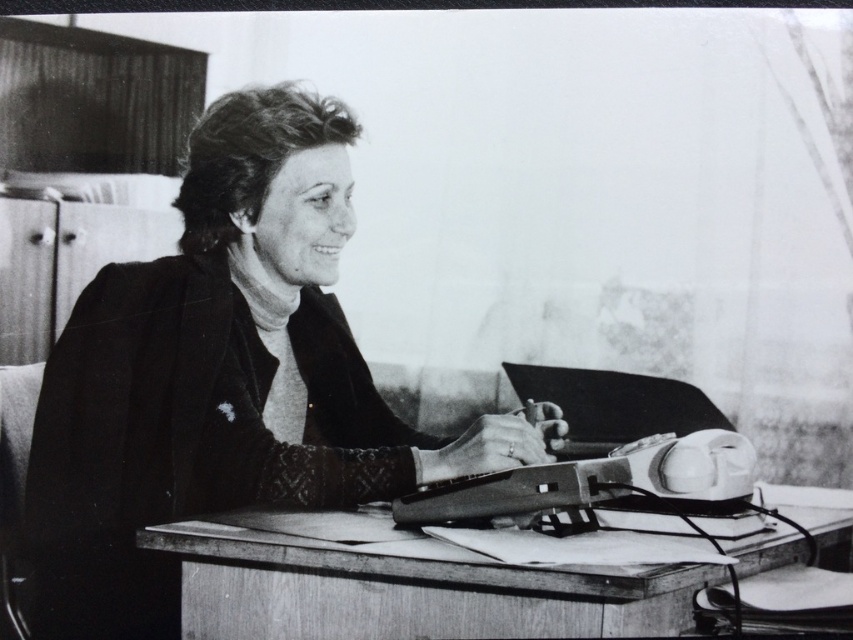
Is smooth black sweater at center behind wooden table at center?

Yes, smooth black sweater at center is behind wooden table at center.

Is point (289, 109) behind point (804, 522)?

Yes.

This screenshot has height=640, width=853. I want to click on smooth black sweater at center, so click(x=219, y=376).

Who is more distant from viewer, (326, 572) or (643, 396)?

The point (643, 396) is more distant.

Between point (428, 580) and point (674, 426), which one is positioned in front?

Positioned in front is point (428, 580).

Identify the location of wooden table at center. Image resolution: width=853 pixels, height=640 pixels. (408, 593).

Is point (335, 372) positioned before point (705, 401)?

No, (335, 372) is behind (705, 401).

Between point (51, 524) and point (572, 388), which one is positioned behind?

The point (572, 388) is behind.

The image size is (853, 640). I want to click on smooth black sweater at center, so click(219, 376).